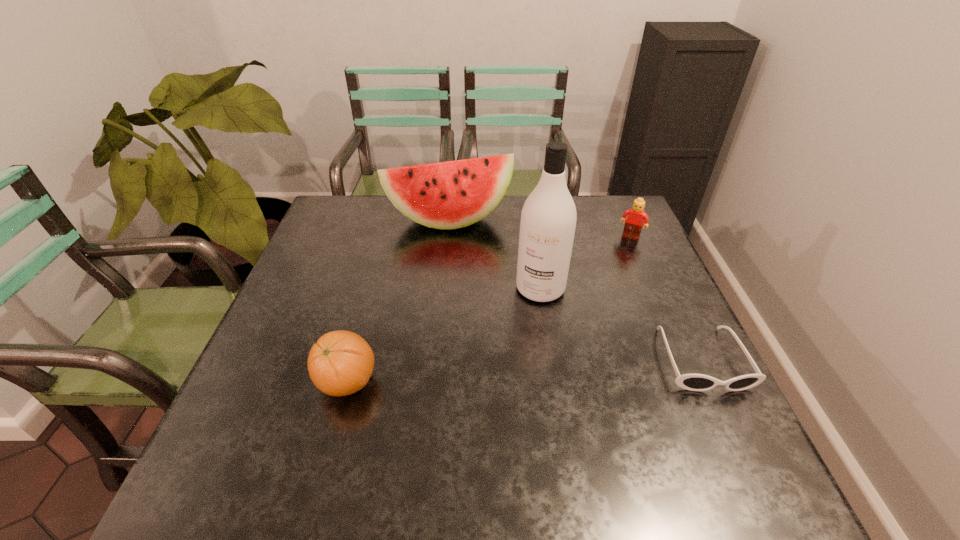
In the image, there is a desktop. At what (x,y) coordinates should I click in order to perform the action: click on vacant space at the far right corner. Please return your answer as a coordinate pair (x, y). Looking at the image, I should click on (589, 198).

The width and height of the screenshot is (960, 540). In order to click on free point between the Lego and the orange in this screenshot , I will do `click(489, 309)`.

Locate an element on the screen. empty space between the shampoo and the watermelon is located at coordinates (494, 254).

The height and width of the screenshot is (540, 960). I want to click on free spot between the Lego and the orange, so 489,309.

Where is `vacant region between the Lego and the shortest object`? The height and width of the screenshot is (540, 960). vacant region between the Lego and the shortest object is located at coordinates (666, 298).

You are a GUI agent. You are given a task and a screenshot of the screen. Output one action in this format:
    pyautogui.click(x=<x>, y=<y>)
    Task: Click on the free space between the shortest object and the orange
    
    Given the screenshot: What is the action you would take?
    pyautogui.click(x=524, y=370)

Identify the location of free space between the orange and the watermelon. (397, 301).

Where is `vacant area that lies between the sunglasses and the Lego`? The image size is (960, 540). vacant area that lies between the sunglasses and the Lego is located at coordinates (666, 298).

This screenshot has width=960, height=540. I want to click on free space between the Lego and the orange, so click(489, 309).

Find the location of a particular element. This screenshot has width=960, height=540. vacant region between the Lego and the orange is located at coordinates (489, 309).